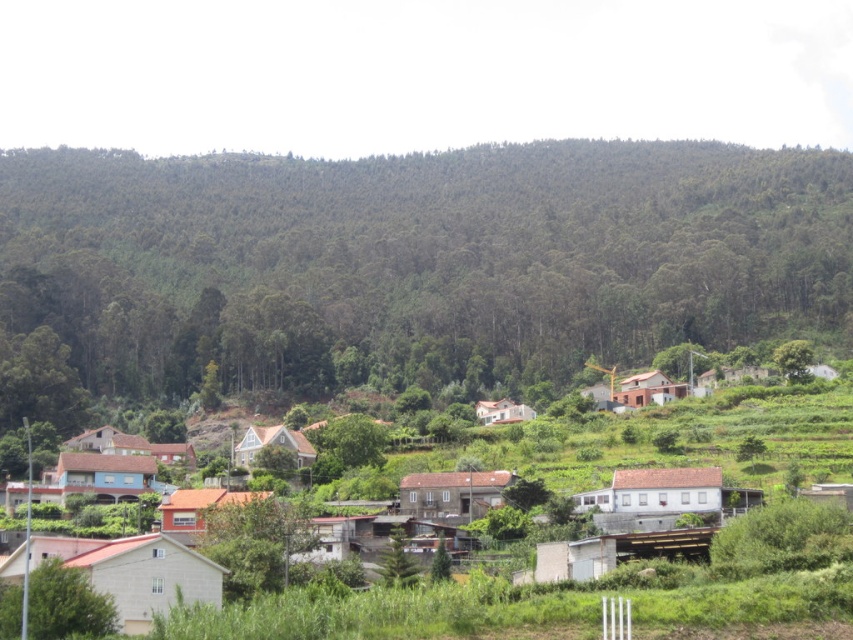
Find the location of a particular element. Image resolution: width=853 pixels, height=640 pixels. blue painted wooden house at lower left is located at coordinates (105, 476).

Is point (91, 472) positioned in front of point (86, 433)?

Yes, it is.

Who is more forward, (x=102, y=472) or (x=86, y=445)?

Point (x=102, y=472) is in front.

Locate an element on the screen. This screenshot has width=853, height=640. blue painted wooden house at lower left is located at coordinates (105, 476).

Who is lower down, green leafy forest at upper center or white brick house at lower left?

white brick house at lower left is below.

Where is `green leafy forest at upper center`? The image size is (853, 640). green leafy forest at upper center is located at coordinates (419, 260).

At what (x,y) coordinates should I click in order to perform the action: click on green leafy forest at upper center. Please return your answer as a coordinate pair (x, y). Image resolution: width=853 pixels, height=640 pixels. Looking at the image, I should click on (x=419, y=260).

Looking at this image, does orange matte house at lower left have a larger size compared to white wooden house at center?

Yes, orange matte house at lower left is bigger than white wooden house at center.

Is orange matte house at lower left shorter than white wooden house at center?

No, orange matte house at lower left is not shorter than white wooden house at center.

Is point (171, 516) behind point (270, 429)?

No, (171, 516) is in front of (270, 429).

You are a GUI agent. You are given a task and a screenshot of the screen. Output one action in this format:
    pyautogui.click(x=<x>, y=<y>)
    Task: Click on the orange matte house at lower left
    This screenshot has width=853, height=640.
    Given the screenshot: What is the action you would take?
    pyautogui.click(x=199, y=509)